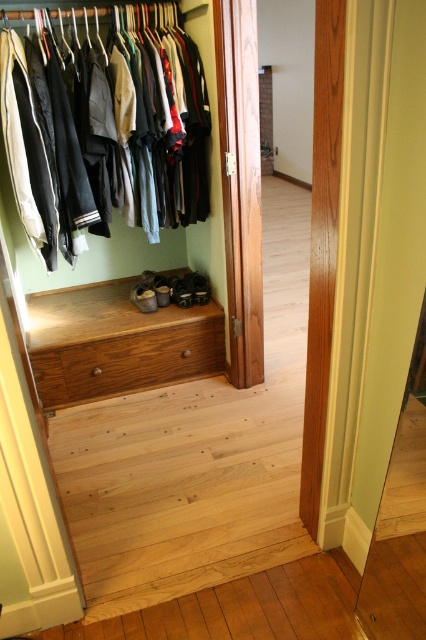
Question: Does matte black clothes at upper left come in front of matte brown shoe at center?

Choices:
 (A) yes
 (B) no

Answer: (A)

Question: Is the position of wooden drawer at center more distant than that of leather shoe at center?

Choices:
 (A) yes
 (B) no

Answer: (B)

Question: Which point is closer to the camera taking this photo?

Choices:
 (A) (204, 282)
 (B) (189, 282)

Answer: (B)

Question: Which object appears closest to the camera in this image?

Choices:
 (A) matte black shoes at center
 (B) matte brown shoe at center
 (C) matte black clothes at upper left
 (D) wooden drawer at center

Answer: (C)

Question: Is matte black shoes at center below leather shoe at center?

Choices:
 (A) no
 (B) yes

Answer: (A)

Question: Among these points, which one is farthest from the camera?

Choices:
 (A) (170, 316)
 (B) (140, 296)
 (C) (150, 298)

Answer: (B)